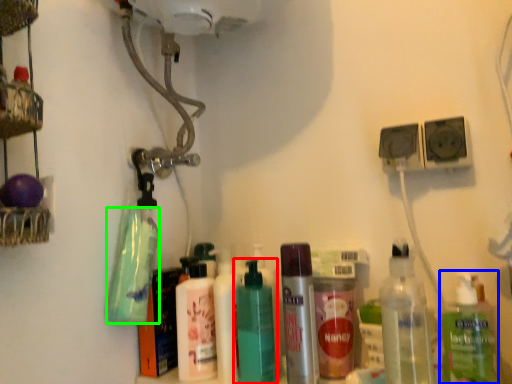
Question: Considering the real-world distances, which object is closest to bottle (highlighted by a red box)? bottle (highlighted by a blue box) or cleaning product (highlighted by a green box).

Choices:
 (A) bottle
 (B) cleaning product

Answer: (B)